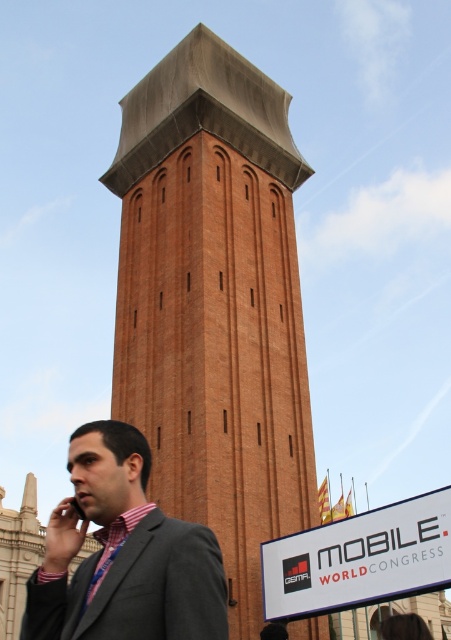
This screenshot has width=451, height=640. Describe the element at coordinates (215, 305) in the screenshot. I see `brown brick tower at center` at that location.

I want to click on brown brick tower at center, so click(x=215, y=305).